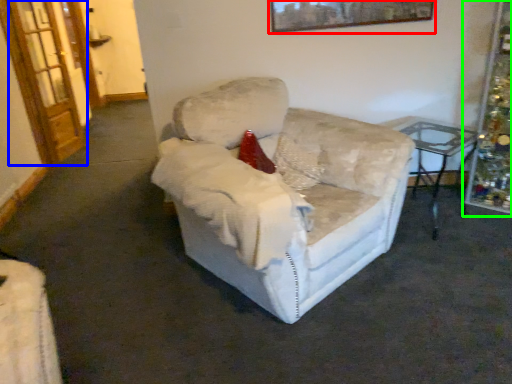
Question: Which is farther away from picture frame (highlighted by a red box)? glass door (highlighted by a blue box) or christmas decoration (highlighted by a green box)?

Choices:
 (A) glass door
 (B) christmas decoration

Answer: (A)